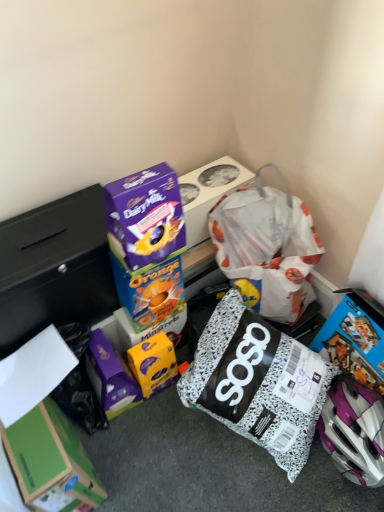
Where is `blue cardboard box at center, which appears as the third box when viewed from the top`? blue cardboard box at center, which appears as the third box when viewed from the top is located at coordinates (150, 292).

Where is `purple cardboard dairy milk chocolate bar at upper center, the fifth box in the bottom-to-top sequence`? purple cardboard dairy milk chocolate bar at upper center, the fifth box in the bottom-to-top sequence is located at coordinates (208, 193).

Locate an element on the screen. yellow matte chocolate bar at center, which is the fourth box from top to bottom is located at coordinates (153, 364).

At what (x,y) coordinates should I click in order to perform the action: click on speckled fabric diaper bag at center. Please return your answer as a coordinate pair (x, y). This screenshot has width=384, height=512. Looking at the image, I should click on (258, 383).

Where is `purple glossy chocolate bar at upper center, which is counted as the 2th box, starting from the top`? purple glossy chocolate bar at upper center, which is counted as the 2th box, starting from the top is located at coordinates (145, 218).

From the image's perspective, is purple glossy chocolate bar at upper center, positioned as the fourth box in bottom-to-top order, over purple cardboard dairy milk chocolate bar at upper center, the fifth box in the bottom-to-top sequence?

Incorrect, from the image's perspective, purple glossy chocolate bar at upper center, positioned as the fourth box in bottom-to-top order, is lower than purple cardboard dairy milk chocolate bar at upper center, the fifth box in the bottom-to-top sequence.

Considering the sizes of objects purple glossy chocolate bar at upper center, which is counted as the 2th box, starting from the top, and purple cardboard dairy milk chocolate bar at upper center, arranged as the 1th box when viewed from the top, in the image provided, who is shorter, purple glossy chocolate bar at upper center, which is counted as the 2th box, starting from the top, or purple cardboard dairy milk chocolate bar at upper center, arranged as the 1th box when viewed from the top,?

Standing shorter between the two is purple cardboard dairy milk chocolate bar at upper center, arranged as the 1th box when viewed from the top.

Find the location of a particular element. box on the right of purple glossy chocolate bar at upper center, positioned as the fourth box in bottom-to-top order is located at coordinates (208, 193).

Which is closer, (116, 216) or (197, 221)?

Point (116, 216)

How far apart are purple glossy chocolate bar at upper center, which is counted as the 2th box, starting from the top, and green cardboard box at lower left, the 1th box from the bottom?

purple glossy chocolate bar at upper center, which is counted as the 2th box, starting from the top, and green cardboard box at lower left, the 1th box from the bottom, are 15.40 inches apart from each other.

Looking at this image, from the image's perspective, is purple glossy chocolate bar at upper center, which is counted as the 2th box, starting from the top, over green cardboard box at lower left, which ranks as the 5th box in top-to-bottom order?

Yes, from the image's perspective, purple glossy chocolate bar at upper center, which is counted as the 2th box, starting from the top, is above green cardboard box at lower left, which ranks as the 5th box in top-to-bottom order.

Considering the positions of objects purple glossy chocolate bar at upper center, which is counted as the 2th box, starting from the top, and green cardboard box at lower left, which ranks as the 5th box in top-to-bottom order, in the image provided, who is more to the right, purple glossy chocolate bar at upper center, which is counted as the 2th box, starting from the top, or green cardboard box at lower left, which ranks as the 5th box in top-to-bottom order,?

Positioned to the right is purple glossy chocolate bar at upper center, which is counted as the 2th box, starting from the top.

Identify the location of the 3rd box above the green cardboard box at lower left, the 1th box from the bottom (from the image's perspective). The width and height of the screenshot is (384, 512). [x=145, y=218].

Looking at this image, based on their positions, is white matte paper at lower left located to the left or right of purple cardboard dairy milk chocolate bar at upper center, the fifth box in the bottom-to-top sequence?

white matte paper at lower left is to the left of purple cardboard dairy milk chocolate bar at upper center, the fifth box in the bottom-to-top sequence.

Can you confirm if white matte paper at lower left is bigger than purple cardboard dairy milk chocolate bar at upper center, the fifth box in the bottom-to-top sequence?

No.

From their relative heights in the image, would you say white matte paper at lower left is taller or shorter than purple cardboard dairy milk chocolate bar at upper center, the fifth box in the bottom-to-top sequence?

white matte paper at lower left is shorter than purple cardboard dairy milk chocolate bar at upper center, the fifth box in the bottom-to-top sequence.

Is white matte paper at lower left with purple cardboard dairy milk chocolate bar at upper center, arranged as the 1th box when viewed from the top?

No, white matte paper at lower left is not beside purple cardboard dairy milk chocolate bar at upper center, arranged as the 1th box when viewed from the top.

In the scene shown: Is green cardboard box at lower left, the 1th box from the bottom, oriented towards purple glossy chocolate bar at upper center, positioned as the fourth box in bottom-to-top order?

No, green cardboard box at lower left, the 1th box from the bottom, is not facing towards purple glossy chocolate bar at upper center, positioned as the fourth box in bottom-to-top order.

From a real-world perspective, is green cardboard box at lower left, which ranks as the 5th box in top-to-bottom order, beneath purple glossy chocolate bar at upper center, which is counted as the 2th box, starting from the top?

Yes, from a real-world perspective, green cardboard box at lower left, which ranks as the 5th box in top-to-bottom order, is beneath purple glossy chocolate bar at upper center, which is counted as the 2th box, starting from the top.

From the image's perspective, is green cardboard box at lower left, the 1th box from the bottom, on purple glossy chocolate bar at upper center, positioned as the fourth box in bottom-to-top order?

No, from the image's perspective, green cardboard box at lower left, the 1th box from the bottom, is not on top of purple glossy chocolate bar at upper center, positioned as the fourth box in bottom-to-top order.

Is green cardboard box at lower left, the 1th box from the bottom, positioned beyond the bounds of purple glossy chocolate bar at upper center, positioned as the fourth box in bottom-to-top order?

Absolutely, green cardboard box at lower left, the 1th box from the bottom, is external to purple glossy chocolate bar at upper center, positioned as the fourth box in bottom-to-top order.

From the image's perspective, between blue cardboard box at center, the 3th box ordered from the bottom, and speckled fabric diaper bag at center, which one is located above?

Result: blue cardboard box at center, the 3th box ordered from the bottom, is shown above in the image.

Is blue cardboard box at center, which appears as the third box when viewed from the top, far away from speckled fabric diaper bag at center?

blue cardboard box at center, which appears as the third box when viewed from the top, is actually quite close to speckled fabric diaper bag at center.

Is point (162, 308) positioned after point (199, 358)?

Yes.

Can you tell me how much blue cardboard box at center, the 3th box ordered from the bottom, and speckled fabric diaper bag at center differ in facing direction?

They differ by 21 degrees in their facing directions.

Is green cardboard box at lower left, which ranks as the 5th box in top-to-bottom order, taller than purple cardboard dairy milk chocolate bar at upper center, the fifth box in the bottom-to-top sequence?

Correct, green cardboard box at lower left, which ranks as the 5th box in top-to-bottom order, is much taller as purple cardboard dairy milk chocolate bar at upper center, the fifth box in the bottom-to-top sequence.

What's the angular difference between green cardboard box at lower left, the 1th box from the bottom, and purple cardboard dairy milk chocolate bar at upper center, arranged as the 1th box when viewed from the top,'s facing directions?

The angle between the facing direction of green cardboard box at lower left, the 1th box from the bottom, and the facing direction of purple cardboard dairy milk chocolate bar at upper center, arranged as the 1th box when viewed from the top, is 87.5 degrees.

From a real-world perspective, is green cardboard box at lower left, the 1th box from the bottom, on purple cardboard dairy milk chocolate bar at upper center, the fifth box in the bottom-to-top sequence?

No, from a real-world perspective, green cardboard box at lower left, the 1th box from the bottom, is not on top of purple cardboard dairy milk chocolate bar at upper center, the fifth box in the bottom-to-top sequence.

Is purple glossy chocolate bar at upper center, positioned as the fourth box in bottom-to-top order, inside or outside of yellow matte chocolate bar at center, the 2th box when ordered from bottom to top?

purple glossy chocolate bar at upper center, positioned as the fourth box in bottom-to-top order, cannot be found inside yellow matte chocolate bar at center, the 2th box when ordered from bottom to top.

Is there a large distance between purple glossy chocolate bar at upper center, which is counted as the 2th box, starting from the top, and yellow matte chocolate bar at center, which is the fourth box from top to bottom?

No, purple glossy chocolate bar at upper center, which is counted as the 2th box, starting from the top, is not far from yellow matte chocolate bar at center, which is the fourth box from top to bottom.

Does point (114, 194) lie behind point (146, 346)?

No, (114, 194) is in front of (146, 346).

Can you confirm if purple glossy chocolate bar at upper center, which is counted as the 2th box, starting from the top, is smaller than yellow matte chocolate bar at center, the 2th box when ordered from bottom to top?

Actually, purple glossy chocolate bar at upper center, which is counted as the 2th box, starting from the top, might be larger than yellow matte chocolate bar at center, the 2th box when ordered from bottom to top.

The image size is (384, 512). Identify the location of the 1st box below the purple cardboard dairy milk chocolate bar at upper center, the fifth box in the bottom-to-top sequence (from the image's perspective). (145, 218).

Where is `box in front of the purple glossy chocolate bar at upper center, which is counted as the 2th box, starting from the top`? This screenshot has height=512, width=384. box in front of the purple glossy chocolate bar at upper center, which is counted as the 2th box, starting from the top is located at coordinates (44, 428).

Looking at the image, which one is located further to purple cardboard dairy milk chocolate bar at upper center, the fifth box in the bottom-to-top sequence, white matte paper at lower left or purple glossy chocolate bar at upper center, positioned as the fourth box in bottom-to-top order?

Among the two, white matte paper at lower left is located further to purple cardboard dairy milk chocolate bar at upper center, the fifth box in the bottom-to-top sequence.

When comparing their distances from blue cardboard box at center, the 3th box ordered from the bottom, does yellow matte chocolate bar at center, which is the fourth box from top to bottom, or purple glossy chocolate bar at upper center, positioned as the fourth box in bottom-to-top order, seem further?

yellow matte chocolate bar at center, which is the fourth box from top to bottom, is positioned further to the anchor blue cardboard box at center, the 3th box ordered from the bottom.

From the image, which object appears to be nearer to white matte paper at lower left, purple glossy chocolate bar at upper center, which is counted as the 2th box, starting from the top, or green cardboard box at lower left, the 1th box from the bottom?

green cardboard box at lower left, the 1th box from the bottom, is positioned closer to the anchor white matte paper at lower left.

When comparing their distances from purple glossy chocolate bar at upper center, positioned as the fourth box in bottom-to-top order, does white matte paper at lower left or green cardboard box at lower left, the 1th box from the bottom, seem further?

green cardboard box at lower left, the 1th box from the bottom, is positioned further to the anchor purple glossy chocolate bar at upper center, positioned as the fourth box in bottom-to-top order.

Looking at the image, which one is located further to purple glossy chocolate bar at upper center, which is counted as the 2th box, starting from the top, speckled fabric diaper bag at center or white matte paper at lower left?

speckled fabric diaper bag at center.

When comparing their distances from speckled fabric diaper bag at center, does yellow matte chocolate bar at center, which is the fourth box from top to bottom, or white matte paper at lower left seem closer?

The object closer to speckled fabric diaper bag at center is yellow matte chocolate bar at center, which is the fourth box from top to bottom.

From the image, which object appears to be nearer to speckled fabric diaper bag at center, purple glossy chocolate bar at upper center, which is counted as the 2th box, starting from the top, or yellow matte chocolate bar at center, the 2th box when ordered from bottom to top?

yellow matte chocolate bar at center, the 2th box when ordered from bottom to top.

Looking at the image, which one is located further to speckled fabric diaper bag at center, blue cardboard box at center, the 3th box ordered from the bottom, or purple cardboard dairy milk chocolate bar at upper center, arranged as the 1th box when viewed from the top?

purple cardboard dairy milk chocolate bar at upper center, arranged as the 1th box when viewed from the top, is positioned further to the anchor speckled fabric diaper bag at center.

Image resolution: width=384 pixels, height=512 pixels. I want to click on box between purple glossy chocolate bar at upper center, positioned as the fourth box in bottom-to-top order, and white matte paper at lower left in the up-down direction, so click(x=150, y=292).

Locate an element on the screen. The width and height of the screenshot is (384, 512). paper between purple cardboard dairy milk chocolate bar at upper center, the fifth box in the bottom-to-top sequence, and green cardboard box at lower left, which ranks as the 5th box in top-to-bottom order, vertically is located at coordinates (33, 373).

I want to click on paper between purple glossy chocolate bar at upper center, which is counted as the 2th box, starting from the top, and yellow matte chocolate bar at center, which is the fourth box from top to bottom, in the vertical direction, so click(33, 373).

Locate an element on the screen. The image size is (384, 512). diaper bag between purple cardboard dairy milk chocolate bar at upper center, arranged as the 1th box when viewed from the top, and green cardboard box at lower left, the 1th box from the bottom, in the vertical direction is located at coordinates (258, 383).